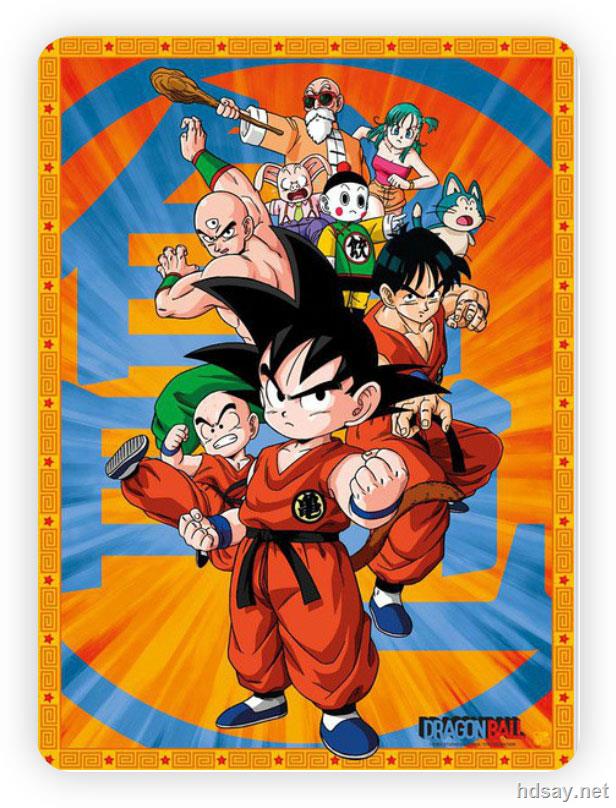
The width and height of the screenshot is (616, 808). In order to click on poster in this screenshot , I will do `click(342, 402)`.